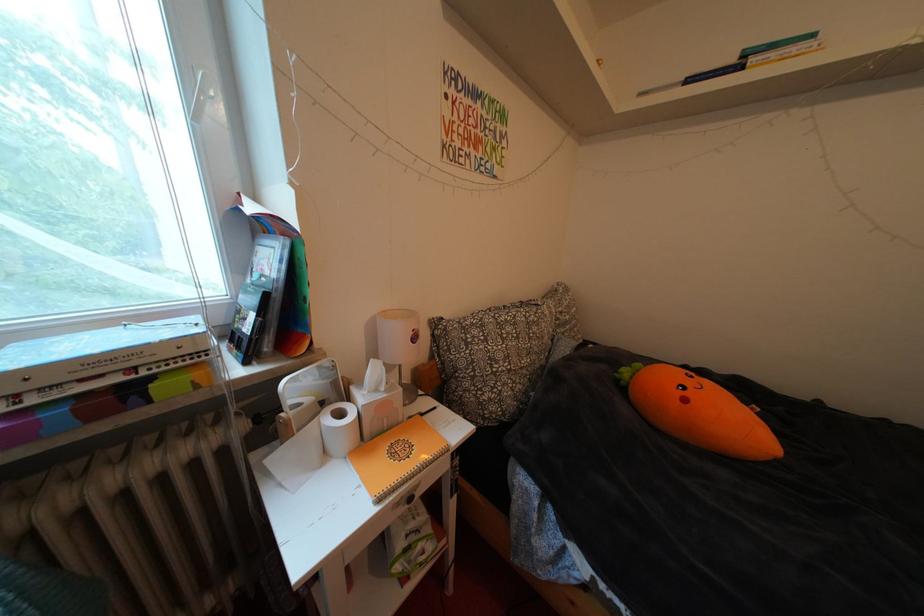
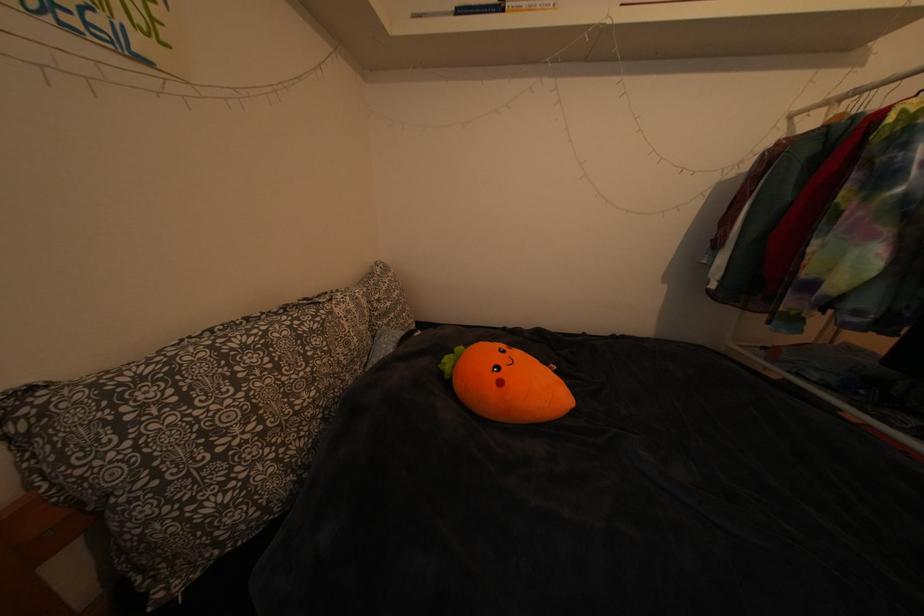
Question: The camera is either moving clockwise (left) or counter-clockwise (right) around the object. The first image is from the beginning of the video and the second image is from the end. Is the camera moving left or right when shooting the video?

Choices:
 (A) Left
 (B) Right

Answer: (A)